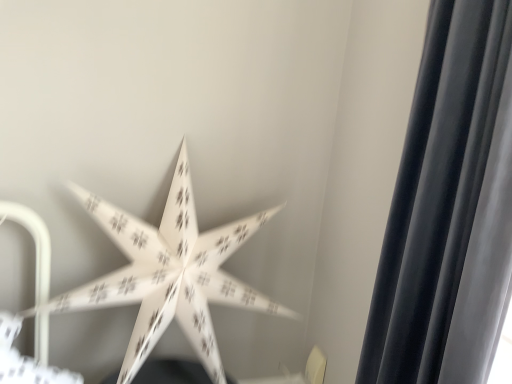
Question: Looking at the image, does white paper star at center seem bigger or smaller compared to silky black curtain at right?

Choices:
 (A) small
 (B) big

Answer: (B)

Question: From their relative heights in the image, would you say white paper star at center is taller or shorter than silky black curtain at right?

Choices:
 (A) short
 (B) tall

Answer: (A)

Question: From a real-world perspective, is white paper star at center physically located above or below silky black curtain at right?

Choices:
 (A) above
 (B) below

Answer: (B)

Question: Do you think silky black curtain at right is within white paper star at center, or outside of it?

Choices:
 (A) inside
 (B) outside

Answer: (B)

Question: Does point (418, 299) appear closer or farther from the camera than point (215, 357)?

Choices:
 (A) closer
 (B) farther

Answer: (A)

Question: From the image's perspective, relative to white paper star at center, is silky black curtain at right above or below?

Choices:
 (A) above
 (B) below

Answer: (A)

Question: Considering the positions of silky black curtain at right and white paper star at center in the image, is silky black curtain at right wider or thinner than white paper star at center?

Choices:
 (A) wide
 (B) thin

Answer: (B)